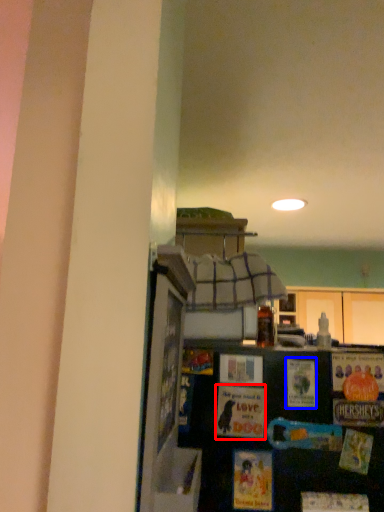
Question: Which point is closer to the camera, postcard (highlighted by a red box) or postcard (highlighted by a blue box)?

Choices:
 (A) postcard
 (B) postcard

Answer: (A)